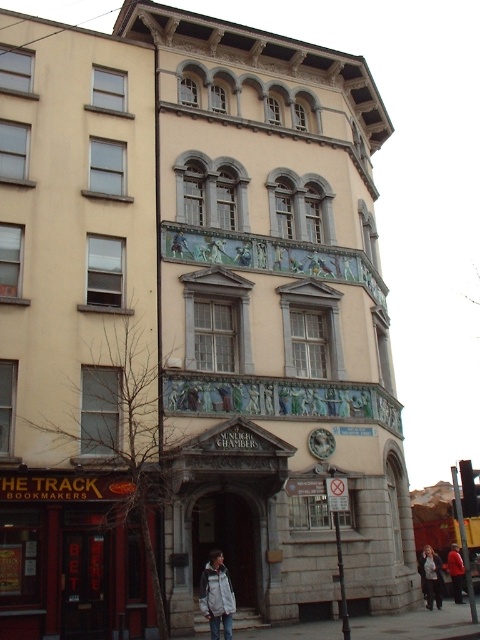
Question: Does white cotton jacket at lower center appear on the left side of red jacket at center?

Choices:
 (A) no
 (B) yes

Answer: (B)

Question: Which of the following is the closest to the observer?

Choices:
 (A) red jacket at center
 (B) white cotton jacket at lower center

Answer: (B)

Question: Which point is closer to the camera taking this photo?

Choices:
 (A) (436, 600)
 (B) (459, 570)

Answer: (A)

Question: Does white cotton jacket at lower center appear on the right side of red jacket at center?

Choices:
 (A) no
 (B) yes

Answer: (A)

Question: Which object is positioned farthest from the red jacket at center?

Choices:
 (A) white cotton jacket at lower center
 (B) white fleece jacket at center

Answer: (B)

Question: Can you confirm if white fleece jacket at center is positioned below red jacket at center?

Choices:
 (A) yes
 (B) no

Answer: (B)